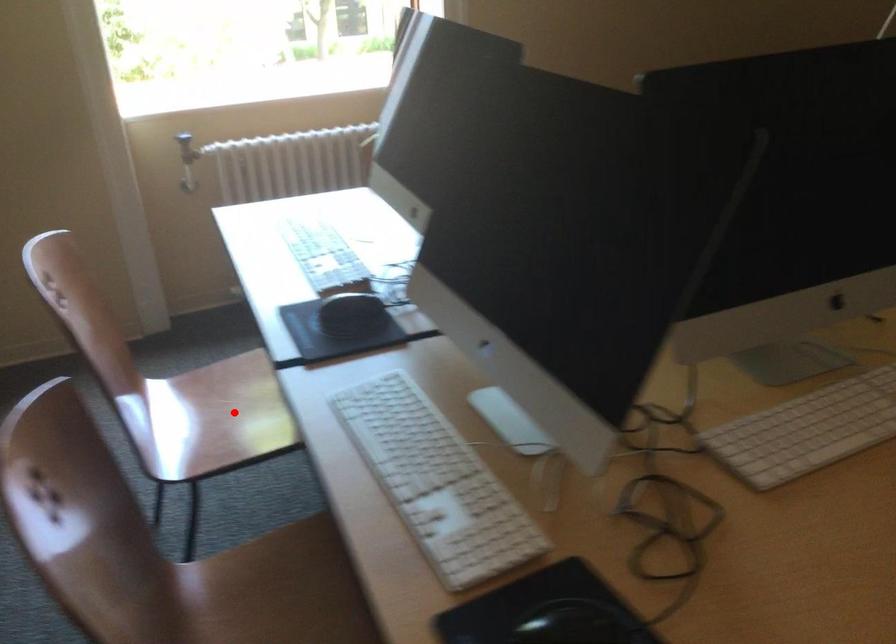
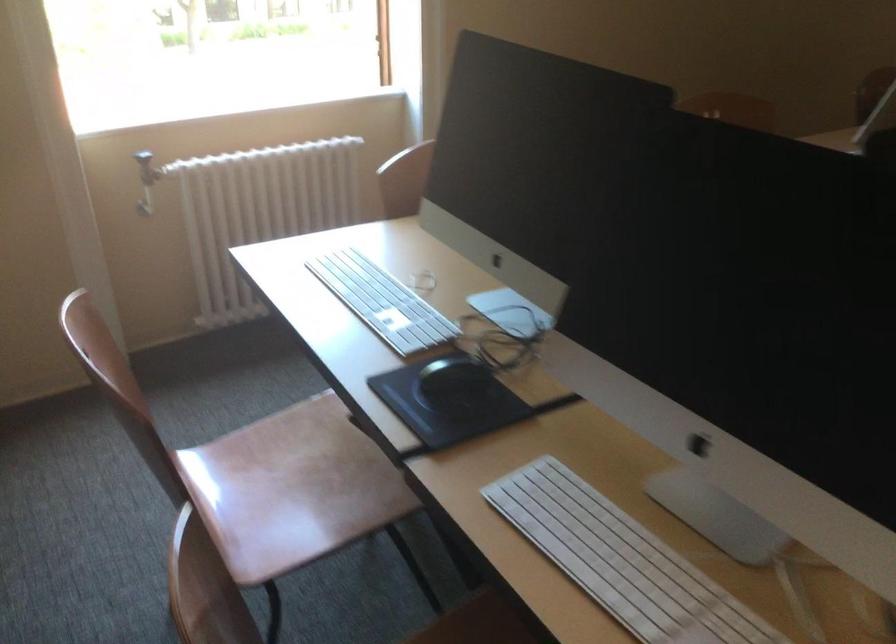
Question: A red point is marked in image1. In image2, is the corresponding 3D point closer to the camera or farther? Reply with the corresponding letter.

Choices:
 (A) The corresponding 3D point is closer.
 (B) The corresponding 3D point is farther.

Answer: (A)